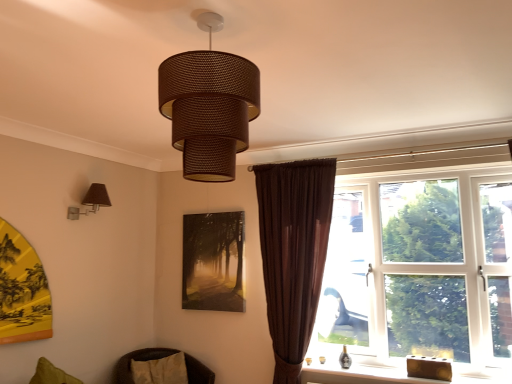
Question: From the image's perspective, is brown velvet curtain at right located above or below brown woven lampshade at center, which ranks as the second lamp in back-to-front order?

Choices:
 (A) above
 (B) below

Answer: (B)

Question: Considering the relative positions of brown velvet curtain at right and brown woven lampshade at center, the first lamp when ordered from right to left, in the image provided, is brown velvet curtain at right to the left or to the right of brown woven lampshade at center, the first lamp when ordered from right to left,?

Choices:
 (A) left
 (B) right

Answer: (B)

Question: Which is nearer to the brown woven cushion at lower left?

Choices:
 (A) brown woven lampshade at center, placed as the first lamp when sorted from top to bottom
 (B) matte brown lampshade at left, the second lamp in the front-to-back sequence
 (C) matte black painting at center
 (D) brown velvet curtain at right
 (E) wooden block at lower right

Answer: (C)

Question: Which of these objects is positioned farthest from the brown velvet curtain at right?

Choices:
 (A) matte black painting at center
 (B) matte brown lampshade at left, which ranks as the second lamp in right-to-left order
 (C) brown woven lampshade at center, which is counted as the 2th lamp, starting from the left
 (D) brown woven cushion at lower left
 (E) velvet beige pillow at lower left

Answer: (C)